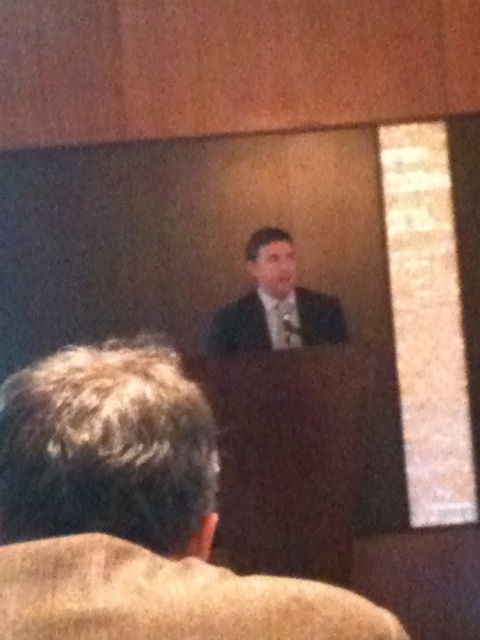
Question: Can you confirm if dark suit at center is thinner than matte black suit at center?

Choices:
 (A) no
 (B) yes

Answer: (B)

Question: Which point is closer to the camera?

Choices:
 (A) (131, 481)
 (B) (237, 346)

Answer: (A)

Question: Does dark suit at center have a greater width compared to matte black suit at center?

Choices:
 (A) yes
 (B) no

Answer: (B)

Question: Observing the image, what is the correct spatial positioning of dark suit at center in reference to matte black suit at center?

Choices:
 (A) below
 (B) above

Answer: (A)

Question: Which point is closer to the camera taking this photo?

Choices:
 (A) (35, 387)
 (B) (236, 308)

Answer: (A)

Question: Which point appears farthest from the camera in this image?

Choices:
 (A) (295, 611)
 (B) (277, 300)

Answer: (B)